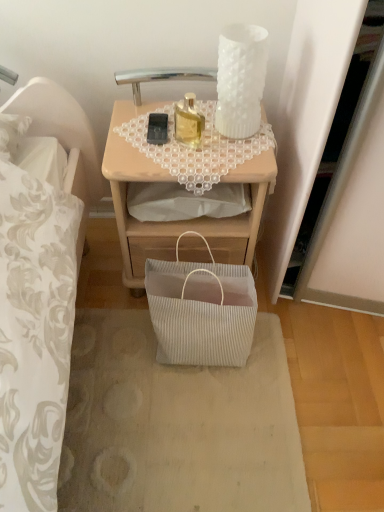
Question: Is the surface of white pleated paper bag at lower center in direct contact with wooden desk at center?

Choices:
 (A) yes
 (B) no

Answer: (B)

Question: Is wooden desk at center a part of white pleated paper bag at lower center?

Choices:
 (A) no
 (B) yes

Answer: (A)

Question: Can you confirm if white pleated paper bag at lower center is wider than wooden desk at center?

Choices:
 (A) yes
 (B) no

Answer: (A)

Question: From the image's perspective, is white pleated paper bag at lower center beneath wooden desk at center?

Choices:
 (A) no
 (B) yes

Answer: (B)

Question: Is white pleated paper bag at lower center taller than wooden desk at center?

Choices:
 (A) yes
 (B) no

Answer: (B)

Question: Considering the positions of black matte mobile phone at upper center and wooden desk at center in the image, is black matte mobile phone at upper center bigger or smaller than wooden desk at center?

Choices:
 (A) small
 (B) big

Answer: (A)

Question: From the image's perspective, is black matte mobile phone at upper center above or below wooden desk at center?

Choices:
 (A) below
 (B) above

Answer: (B)

Question: Is point (160, 140) positioned closer to the camera than point (117, 182)?

Choices:
 (A) closer
 (B) farther

Answer: (B)

Question: Is black matte mobile phone at upper center wider or thinner than wooden desk at center?

Choices:
 (A) wide
 (B) thin

Answer: (B)

Question: From a real-world perspective, is white pleated paper bag at lower center above or below wooden desk at center?

Choices:
 (A) above
 (B) below

Answer: (B)

Question: From their relative heights in the image, would you say white pleated paper bag at lower center is taller or shorter than wooden desk at center?

Choices:
 (A) short
 (B) tall

Answer: (A)

Question: Is white pleated paper bag at lower center spatially inside wooden desk at center, or outside of it?

Choices:
 (A) outside
 (B) inside

Answer: (A)

Question: Is point (76, 500) closer or farther from the camera than point (223, 247)?

Choices:
 (A) closer
 (B) farther

Answer: (A)

Question: From a real-world perspective, is white pleated bag at lower center above or below wooden desk at center?

Choices:
 (A) below
 (B) above

Answer: (A)

Question: From the image's perspective, is white pleated bag at lower center positioned above or below wooden desk at center?

Choices:
 (A) above
 (B) below

Answer: (B)